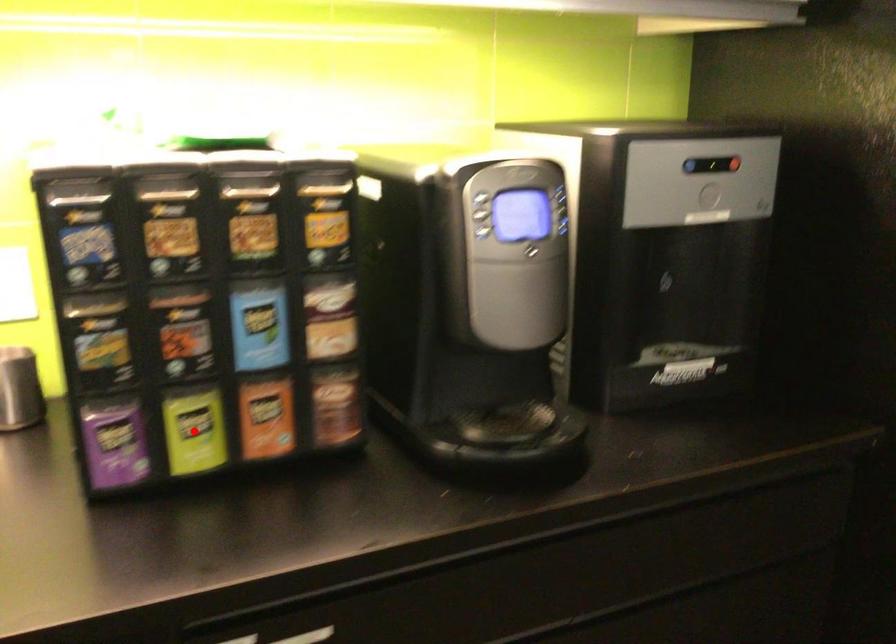
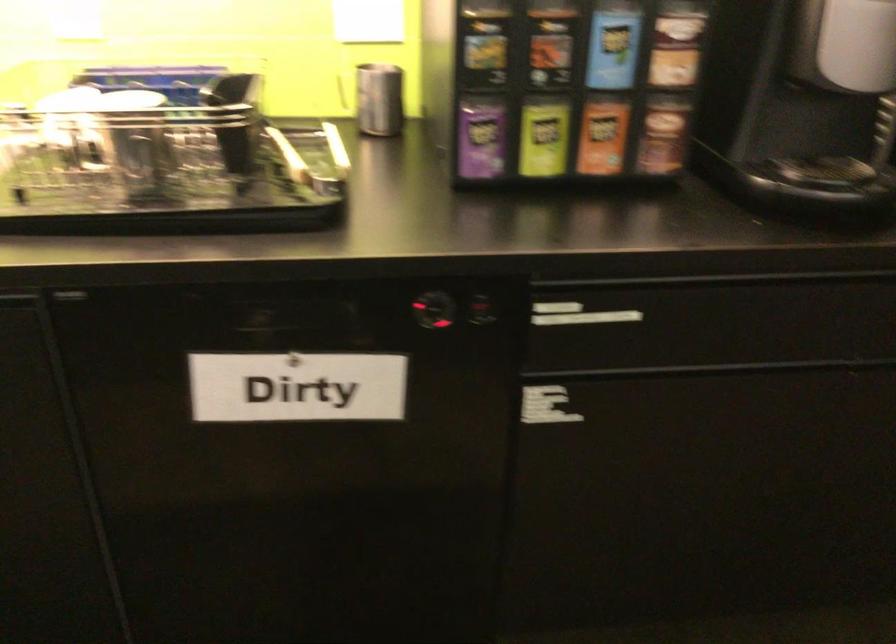
Question: I am providing you with two images of the same scene from different viewpoints. A red point is shown in image1. For the corresponding object point in image2, is it positioned nearer or farther from the camera?

Choices:
 (A) Nearer
 (B) Farther

Answer: (B)